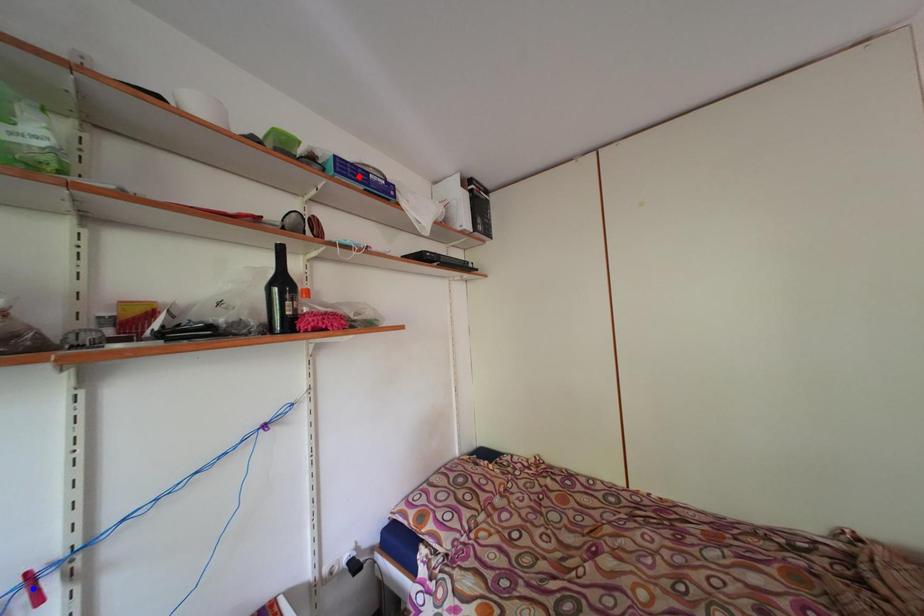
Question: Which of the two points in the image is closer to the camera?

Choices:
 (A) Blue point is closer.
 (B) Red point is closer.

Answer: (A)